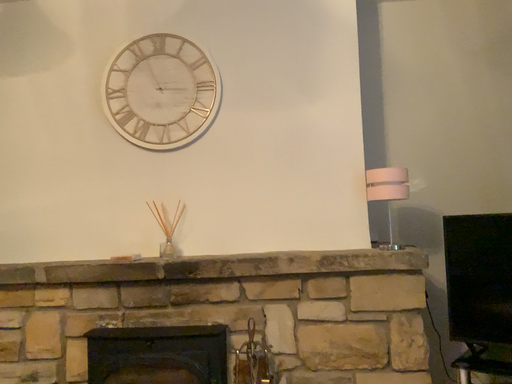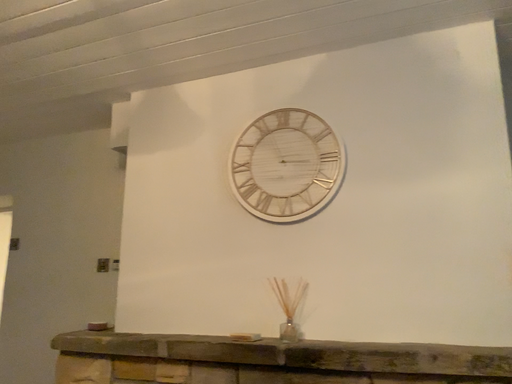
Question: Which way did the camera rotate in the video?

Choices:
 (A) rotated upward
 (B) rotated downward

Answer: (A)